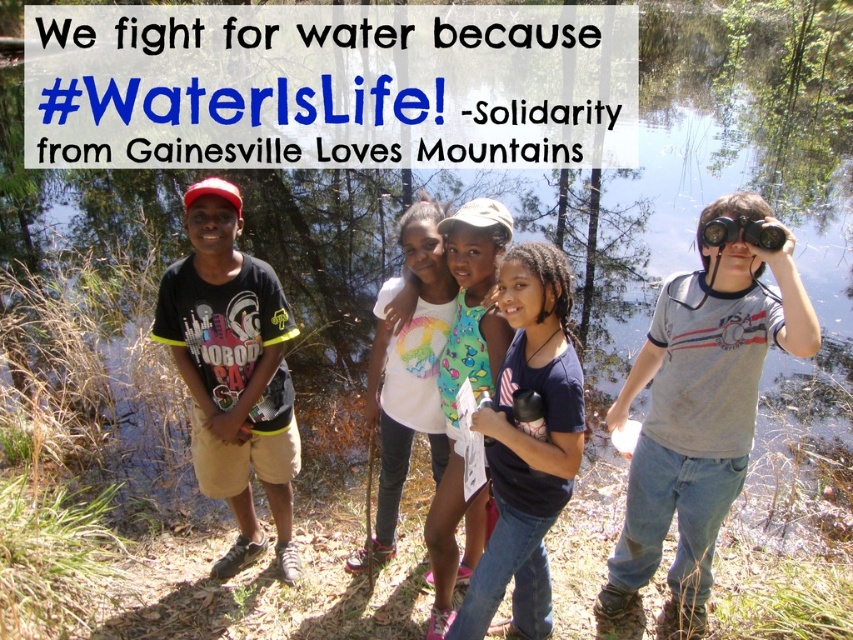
Consider the image. You are a photographer trying to capture a shot of the children. You want to frame the white cotton shirt at center and the gray cotton binoculars at right in your photo. Based on their positions, which object should you place on the left side of your frame?

The white cotton shirt at center is to the left of the gray cotton binoculars at right, so you should place the white cotton shirt at center on the left side of your frame and the gray cotton binoculars at right on the right side.

You are a small robot with a width of 1 meter. You are positioned near the gray cotton binoculars at right and want to move to the white cotton shirt at center. Can you fit through the space between them without moving either object?

The distance between the gray cotton binoculars at right and the white cotton shirt at center is 1.22 meters, which is wider than your 1 meter width. Therefore, you can fit through the space between them without moving either object.

You are a photographer trying to capture a clear shot of the rainbow printed tank top at center. However, the gray cotton binoculars at right are blocking your view. Can you adjust your position to avoid the binoculars and still see the tank top?

The gray cotton binoculars at right are positioned under the rainbow printed tank top at center, so moving your camera angle slightly upward might allow you to see the rainbow printed tank top at center without obstruction from the binoculars.